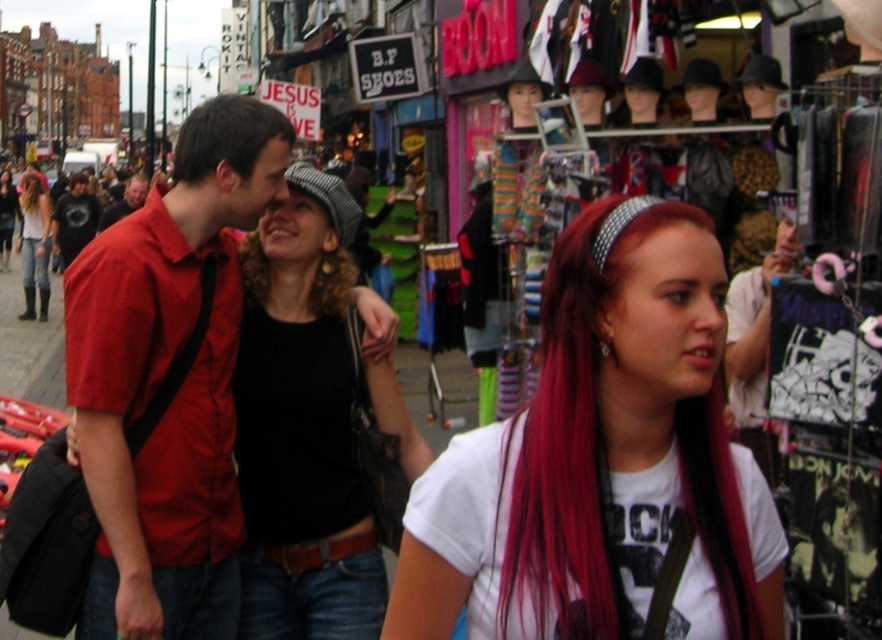
Question: Can you confirm if curly brown hair at center is thinner than matte black shirt at center?

Choices:
 (A) no
 (B) yes

Answer: (B)

Question: Is shiny red hair at center below brown matte hair at upper left?

Choices:
 (A) yes
 (B) no

Answer: (A)

Question: Which object is the farthest from the matte black shirt at center?

Choices:
 (A) blonde hair at center
 (B) curly brown hair at center
 (C) matte red shirt at center

Answer: (B)

Question: Among these objects, which one is nearest to the camera?

Choices:
 (A) brown matte hair at upper left
 (B) black matte shirt at center
 (C) white fabric shirt at center
 (D) shiny red hair at center

Answer: (D)

Question: Is shiny red hair at center to the left of curly brown hair at center from the viewer's perspective?

Choices:
 (A) no
 (B) yes

Answer: (A)

Question: Among these points, which one is farthest from the camera?

Choices:
 (A) (38, 275)
 (B) (327, 634)
 (C) (21, 196)

Answer: (C)